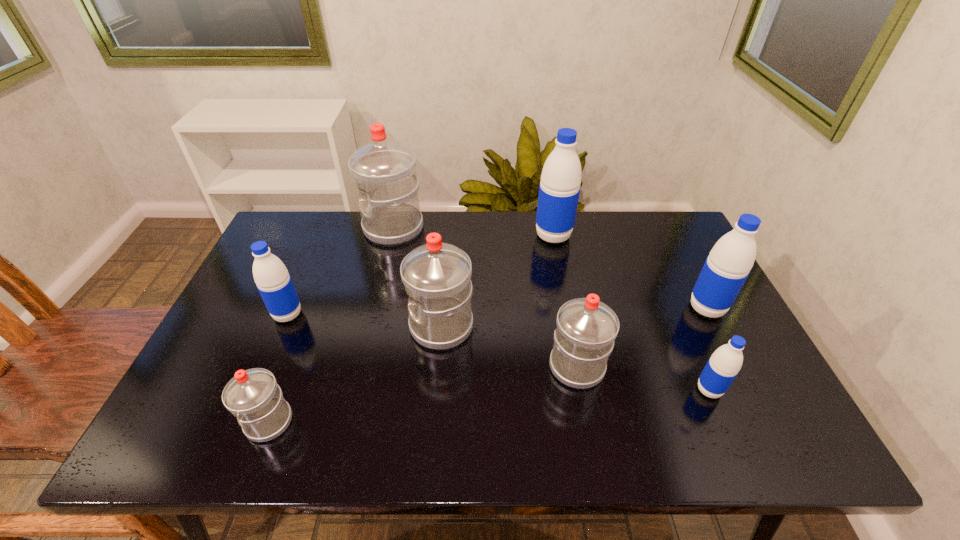
Where is `object situated at the left edge`? object situated at the left edge is located at coordinates (272, 279).

Locate an element on the screen. The image size is (960, 540). free space at the far edge is located at coordinates (520, 220).

You are a GUI agent. You are given a task and a screenshot of the screen. Output one action in this format:
    pyautogui.click(x=<x>, y=<y>)
    Task: Click on the free space at the near edge
    Image resolution: width=960 pixels, height=540 pixels.
    Given the screenshot: What is the action you would take?
    pyautogui.click(x=622, y=416)

Find the location of a particular element. Image resolution: width=960 pixels, height=540 pixels. vacant space at the left edge of the desktop is located at coordinates (240, 307).

Where is `free space at the far right corner of the desktop`? This screenshot has height=540, width=960. free space at the far right corner of the desktop is located at coordinates (661, 214).

Find the location of a particular element. The image size is (960, 540). free space that is in between the third object from left to right and the nearest white water bottle is located at coordinates (331, 325).

Where is `vacant space that is in between the third white water bottle from left to right and the rightmost white water bottle`? vacant space that is in between the third white water bottle from left to right and the rightmost white water bottle is located at coordinates (509, 347).

The width and height of the screenshot is (960, 540). I want to click on vacant space that is in between the nearest blue water bottle and the second smallest white water bottle, so click(x=643, y=379).

The height and width of the screenshot is (540, 960). In order to click on free area in between the nearest blue water bottle and the second smallest white water bottle in this screenshot , I will do `click(643, 379)`.

This screenshot has height=540, width=960. Find the location of `vacant area that lies between the second blue water bottle from left to right and the second white water bottle from left to right`. vacant area that lies between the second blue water bottle from left to right and the second white water bottle from left to right is located at coordinates (473, 232).